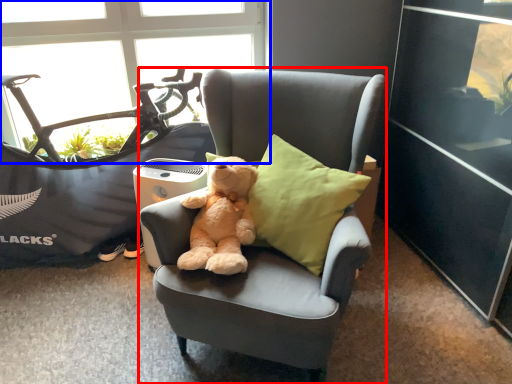
Question: Which point is closer to the camera, chair (highlighted by a red box) or window (highlighted by a blue box)?

Choices:
 (A) chair
 (B) window

Answer: (A)